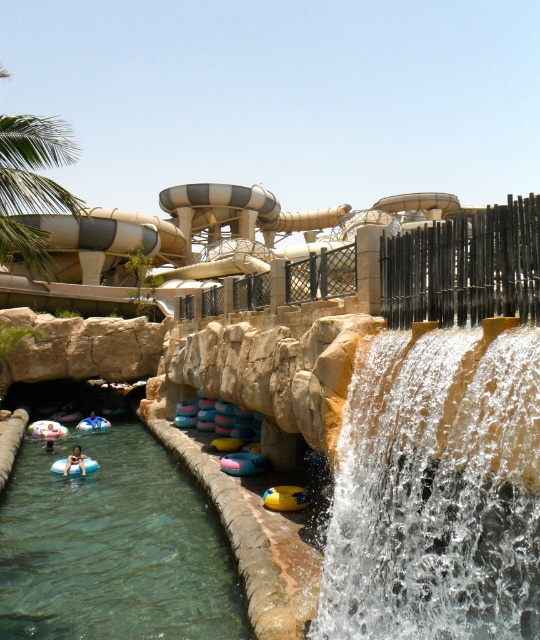
You are a photographer planning to capture the clear water cascade at center and the green leafy palm tree at upper left in a single frame. Which object will appear narrower in your photo?

The clear water cascade at center will appear narrower in the photo because it is thinner than the green leafy palm tree at upper left.

Looking at this image, you are planning to take a photo of the green leafy palm tree at upper left and the light blue rubber ring at lower left. Which object should you focus on first if you want to capture both in a single frame without moving the camera, considering their sizes?

The green leafy palm tree at upper left has a larger width than the light blue rubber ring at lower left, so you should focus on the green leafy palm tree at upper left first to ensure it fits well in the frame before adjusting for the smaller light blue rubber ring at lower left.